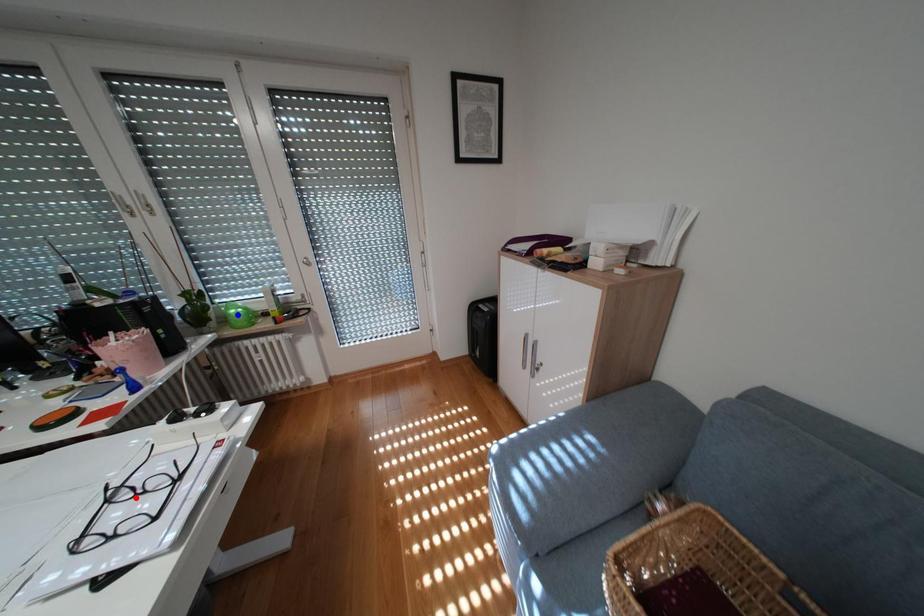
Question: Two points are marked on the image. Which point is closer to the camera?

Choices:
 (A) Blue point is closer.
 (B) Red point is closer.

Answer: (B)